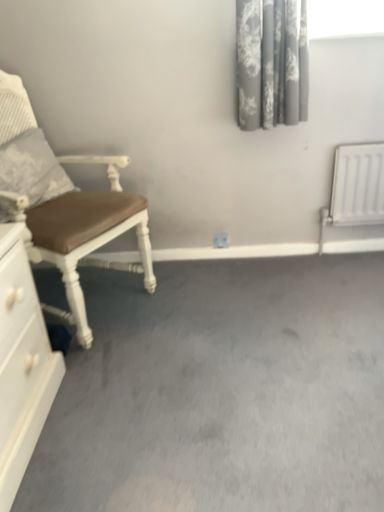
Question: Does textured gray pillow at left come in front of white glossy chest of drawers at lower left?

Choices:
 (A) yes
 (B) no

Answer: (B)

Question: Is textured gray pillow at left facing towards white glossy chest of drawers at lower left?

Choices:
 (A) yes
 (B) no

Answer: (B)

Question: From the image's perspective, is textured gray pillow at left on top of white glossy chest of drawers at lower left?

Choices:
 (A) yes
 (B) no

Answer: (A)

Question: Is textured gray pillow at left bigger than white glossy chest of drawers at lower left?

Choices:
 (A) no
 (B) yes

Answer: (A)

Question: Considering the relative sizes of textured gray pillow at left and white glossy chest of drawers at lower left in the image provided, is textured gray pillow at left taller than white glossy chest of drawers at lower left?

Choices:
 (A) no
 (B) yes

Answer: (A)

Question: From a real-world perspective, relative to brown leather chair at left, is textured gray pillow at left vertically above or below?

Choices:
 (A) below
 (B) above

Answer: (B)

Question: Is textured gray pillow at left inside or outside of brown leather chair at left?

Choices:
 (A) inside
 (B) outside

Answer: (A)

Question: From the image's perspective, is textured gray pillow at left above or below brown leather chair at left?

Choices:
 (A) above
 (B) below

Answer: (A)

Question: Based on their positions, is textured gray pillow at left located to the left or right of brown leather chair at left?

Choices:
 (A) right
 (B) left

Answer: (B)

Question: From a real-world perspective, is textured gray pillow at left positioned above or below gray floral fabric curtain at upper right?

Choices:
 (A) above
 (B) below

Answer: (B)

Question: Considering their positions, is textured gray pillow at left located in front of or behind gray floral fabric curtain at upper right?

Choices:
 (A) behind
 (B) front

Answer: (B)

Question: Is textured gray pillow at left taller or shorter than gray floral fabric curtain at upper right?

Choices:
 (A) short
 (B) tall

Answer: (A)

Question: From the image's perspective, is textured gray pillow at left located above or below gray floral fabric curtain at upper right?

Choices:
 (A) above
 (B) below

Answer: (B)

Question: From the image's perspective, is gray floral fabric curtain at upper right above or below brown leather chair at left?

Choices:
 (A) below
 (B) above

Answer: (B)

Question: Do you think gray floral fabric curtain at upper right is within brown leather chair at left, or outside of it?

Choices:
 (A) outside
 (B) inside

Answer: (A)